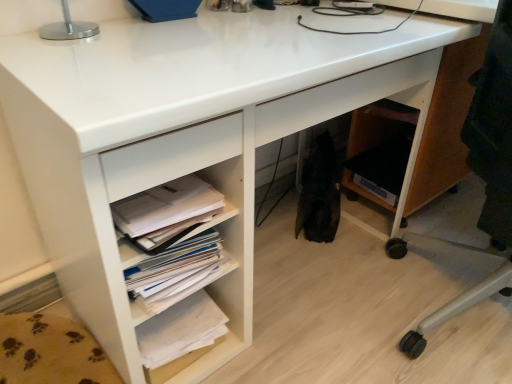
What do you see at coordinates (175, 273) in the screenshot?
I see `white paper stack at lower center, placed as the second book when sorted from bottom to top` at bounding box center [175, 273].

In order to face white paper stack at lower center, marked as the 1th book in a top-to-bottom arrangement, should I rotate leftwards or rightwards?

Turn left by 10.273 degrees to look at white paper stack at lower center, marked as the 1th book in a top-to-bottom arrangement.

What do you see at coordinates (219, 217) in the screenshot? The image size is (512, 384). I see `white paper at lower left` at bounding box center [219, 217].

Locate an element on the screen. This screenshot has height=384, width=512. white paper at lower left is located at coordinates (219, 217).

Locate an element on the screen. white paper stack at lower left, placed as the 1th book when sorted from bottom to top is located at coordinates (180, 330).

Which of these two, white paper stack at lower center, placed as the second book when sorted from bottom to top, or silver metallic table lamp at upper left, is wider?

With larger width is white paper stack at lower center, placed as the second book when sorted from bottom to top.

Between white paper stack at lower center, marked as the 1th book in a top-to-bottom arrangement, and silver metallic table lamp at upper left, which one is positioned behind?

Positioned behind is white paper stack at lower center, marked as the 1th book in a top-to-bottom arrangement.

Is white paper stack at lower center, marked as the 1th book in a top-to-bottom arrangement, smaller than silver metallic table lamp at upper left?

Correct, white paper stack at lower center, marked as the 1th book in a top-to-bottom arrangement, occupies less space than silver metallic table lamp at upper left.

From the image's perspective, is white paper stack at lower center, placed as the second book when sorted from bottom to top, above silver metallic table lamp at upper left?

No, from the image's perspective, white paper stack at lower center, placed as the second book when sorted from bottom to top, is not over silver metallic table lamp at upper left.

Looking at this image, can we say silver metallic table lamp at upper left lies outside white paper stack at lower center, placed as the second book when sorted from bottom to top?

Yes, silver metallic table lamp at upper left is not within white paper stack at lower center, placed as the second book when sorted from bottom to top.

Is silver metallic table lamp at upper left in contact with white paper stack at lower center, placed as the second book when sorted from bottom to top?

silver metallic table lamp at upper left and white paper stack at lower center, placed as the second book when sorted from bottom to top, are not in contact.

Is silver metallic table lamp at upper left looking in the opposite direction of white paper stack at lower center, marked as the 1th book in a top-to-bottom arrangement?

silver metallic table lamp at upper left does not have its back to white paper stack at lower center, marked as the 1th book in a top-to-bottom arrangement.

Is the position of silver metallic table lamp at upper left less distant than that of white paper stack at lower center, placed as the second book when sorted from bottom to top?

That is True.

Does silver metallic table lamp at upper left have a greater width compared to white paper stack at lower left, which appears as the second book when viewed from the top?

Incorrect, the width of silver metallic table lamp at upper left does not surpass that of white paper stack at lower left, which appears as the second book when viewed from the top.

Is silver metallic table lamp at upper left taller or shorter than white paper stack at lower left, which appears as the second book when viewed from the top?

Clearly, silver metallic table lamp at upper left is taller compared to white paper stack at lower left, which appears as the second book when viewed from the top.

Looking at this image, can we say silver metallic table lamp at upper left lies outside white paper stack at lower left, which appears as the second book when viewed from the top?

Absolutely, silver metallic table lamp at upper left is external to white paper stack at lower left, which appears as the second book when viewed from the top.

Considering the relative sizes of silver metallic table lamp at upper left and white paper stack at lower left, placed as the 1th book when sorted from bottom to top, in the image provided, is silver metallic table lamp at upper left bigger than white paper stack at lower left, placed as the 1th book when sorted from bottom to top,?

Yes, silver metallic table lamp at upper left is bigger than white paper stack at lower left, placed as the 1th book when sorted from bottom to top.

At what (x,y) coordinates should I click in order to perform the action: click on shelf below the wooden office chair at lower right (from the image's perspective). Please return your answer as a coordinate pair (x, y). This screenshot has height=384, width=512. Looking at the image, I should click on (219, 217).

Considering the sizes of wooden office chair at lower right and white paper at lower left in the image, is wooden office chair at lower right wider or thinner than white paper at lower left?

In the image, wooden office chair at lower right appears to be wider than white paper at lower left.

In the scene shown: Is the position of wooden office chair at lower right more distant than that of white paper at lower left?

No, it is not.

Based on the photo, is wooden office chair at lower right situated inside white paper at lower left or outside?

wooden office chair at lower right is not enclosed by white paper at lower left.

Is there a large distance between white paper stack at lower left, which appears as the second book when viewed from the top, and silver metallic table lamp at upper left?

They are positioned close to each other.

From a real-world perspective, between white paper stack at lower left, placed as the 1th book when sorted from bottom to top, and silver metallic table lamp at upper left, who is vertically lower?

white paper stack at lower left, placed as the 1th book when sorted from bottom to top, is physically lower.

Looking at their sizes, would you say white paper stack at lower left, which appears as the second book when viewed from the top, is wider or thinner than silver metallic table lamp at upper left?

In the image, white paper stack at lower left, which appears as the second book when viewed from the top, appears to be wider than silver metallic table lamp at upper left.

Considering the positions of objects white paper at lower left and silver metallic table lamp at upper left in the image provided, who is more to the left, white paper at lower left or silver metallic table lamp at upper left?

silver metallic table lamp at upper left is more to the left.

The height and width of the screenshot is (384, 512). In the image, there is a white paper at lower left. Identify the location of table lamp above it (from the image's perspective). click(x=68, y=28).

Is white paper at lower left facing away from silver metallic table lamp at upper left?

No, white paper at lower left is not facing away from silver metallic table lamp at upper left.

From a real-world perspective, which is physically above, white paper at lower left or silver metallic table lamp at upper left?

silver metallic table lamp at upper left is physically above.

Is silver metallic table lamp at upper left oriented towards wooden office chair at lower right?

No, silver metallic table lamp at upper left does not turn towards wooden office chair at lower right.

From a real-world perspective, is silver metallic table lamp at upper left located higher than wooden office chair at lower right?

Yes, from a real-world perspective, silver metallic table lamp at upper left is on top of wooden office chair at lower right.

What's the angular difference between silver metallic table lamp at upper left and wooden office chair at lower right's facing directions?

The angle between the facing direction of silver metallic table lamp at upper left and the facing direction of wooden office chair at lower right is 90.5 degrees.

Which of these two, silver metallic table lamp at upper left or wooden office chair at lower right, is wider?

With larger width is wooden office chair at lower right.

From the image's perspective, starting from the silver metallic table lamp at upper left, which book is the 1st one below? Please provide its 2D coordinates.

[(175, 273)]

The height and width of the screenshot is (384, 512). Find the location of `table lamp that is above the white paper stack at lower center, marked as the 1th book in a top-to-bottom arrangement (from a real-world perspective)`. table lamp that is above the white paper stack at lower center, marked as the 1th book in a top-to-bottom arrangement (from a real-world perspective) is located at coordinates (68, 28).

Looking at the image, which one is located further to wooden office chair at lower right, white paper stack at lower left, placed as the 1th book when sorted from bottom to top, or white paper stack at lower center, marked as the 1th book in a top-to-bottom arrangement?

white paper stack at lower center, marked as the 1th book in a top-to-bottom arrangement, is further to wooden office chair at lower right.

Estimate the real-world distances between objects in this image. Which object is further from wooden office chair at lower right, silver metallic table lamp at upper left or white paper stack at lower center, placed as the second book when sorted from bottom to top?

silver metallic table lamp at upper left.

Which object lies further to the anchor point white paper stack at lower left, which appears as the second book when viewed from the top, white paper at lower left or wooden office chair at lower right?

The object further to white paper stack at lower left, which appears as the second book when viewed from the top, is wooden office chair at lower right.

Looking at this image, when comparing their distances from white paper stack at lower center, placed as the second book when sorted from bottom to top, does white paper stack at lower left, which appears as the second book when viewed from the top, or wooden office chair at lower right seem closer?

Among the two, white paper stack at lower left, which appears as the second book when viewed from the top, is located nearer to white paper stack at lower center, placed as the second book when sorted from bottom to top.

From the image, which object appears to be farther from wooden office chair at lower right, white paper stack at lower left, placed as the 1th book when sorted from bottom to top, or white paper at lower left?

The object further to wooden office chair at lower right is white paper stack at lower left, placed as the 1th book when sorted from bottom to top.

Looking at this image, when comparing their distances from white paper stack at lower left, placed as the 1th book when sorted from bottom to top, does wooden office chair at lower right or silver metallic table lamp at upper left seem further?

The object further to white paper stack at lower left, placed as the 1th book when sorted from bottom to top, is silver metallic table lamp at upper left.

Based on their spatial positions, is wooden office chair at lower right or silver metallic table lamp at upper left further from white paper stack at lower center, marked as the 1th book in a top-to-bottom arrangement?

wooden office chair at lower right lies further to white paper stack at lower center, marked as the 1th book in a top-to-bottom arrangement, than the other object.

From the image, which object appears to be farther from silver metallic table lamp at upper left, white paper at lower left or wooden office chair at lower right?

Among the two, wooden office chair at lower right is located further to silver metallic table lamp at upper left.

Find the location of a particular element. shelf between silver metallic table lamp at upper left and wooden office chair at lower right from left to right is located at coordinates (219, 217).

Where is `book situated between white paper stack at lower left, which appears as the second book when viewed from the top, and wooden office chair at lower right from left to right`? This screenshot has width=512, height=384. book situated between white paper stack at lower left, which appears as the second book when viewed from the top, and wooden office chair at lower right from left to right is located at coordinates (175, 273).

Where is `shelf between silver metallic table lamp at upper left and white paper stack at lower left, placed as the 1th book when sorted from bottom to top, vertically`? This screenshot has height=384, width=512. shelf between silver metallic table lamp at upper left and white paper stack at lower left, placed as the 1th book when sorted from bottom to top, vertically is located at coordinates (219, 217).

The image size is (512, 384). I want to click on book between silver metallic table lamp at upper left and white paper stack at lower left, placed as the 1th book when sorted from bottom to top, vertically, so click(x=175, y=273).